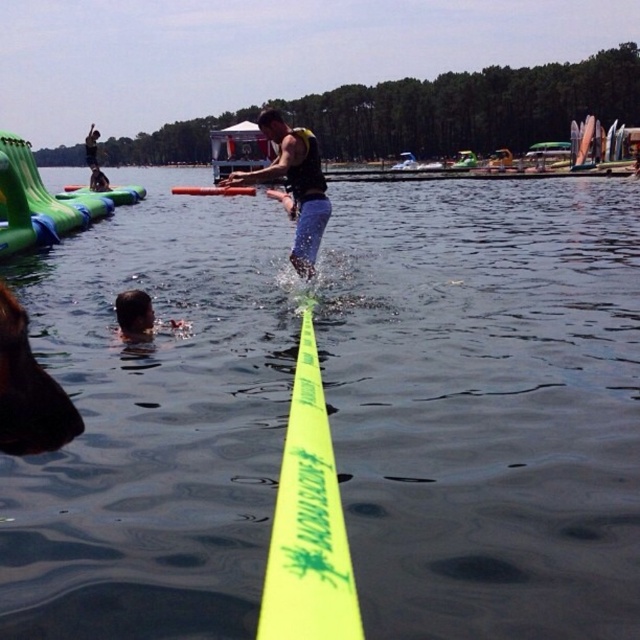
Can you confirm if neon yellow plastic paddle at center is thinner than dark blue wetsuit at upper left?

Yes, neon yellow plastic paddle at center is thinner than dark blue wetsuit at upper left.

Is neon yellow plastic paddle at center taller than dark blue wetsuit at upper left?

No.

At what (x,y) coordinates should I click in order to perform the action: click on neon yellow plastic paddle at center. Please return your answer as a coordinate pair (x, y). This screenshot has width=640, height=640. Looking at the image, I should click on (308, 522).

Where is `neon yellow plastic paddle at center`? The image size is (640, 640). neon yellow plastic paddle at center is located at coordinates (308, 522).

Which is behind, point (445, 188) or point (284, 632)?

Point (445, 188)

Between yellow neon tape at center and neon yellow plastic paddle at center, which one has less height?

With less height is neon yellow plastic paddle at center.

Between point (424, 544) and point (291, 451), which one is positioned in front?

Point (291, 451) is more forward.

You are a GUI agent. You are given a task and a screenshot of the screen. Output one action in this format:
    pyautogui.click(x=<x>, y=<y>)
    Task: Click on the yellow neon tape at center
    This screenshot has width=640, height=640.
    Given the screenshot: What is the action you would take?
    pyautogui.click(x=486, y=403)

Does neon yellow plastic paddle at center come behind dark blue fabric shirt at upper left?

No, it is in front of dark blue fabric shirt at upper left.

Is point (314, 378) positioned in front of point (108, 179)?

Yes.

Find the location of a particular element. The width and height of the screenshot is (640, 640). neon yellow plastic paddle at center is located at coordinates (308, 522).

At what (x,y) coordinates should I click in order to perform the action: click on neon yellow plastic paddle at center. Please return your answer as a coordinate pair (x, y). The image size is (640, 640). Looking at the image, I should click on (308, 522).